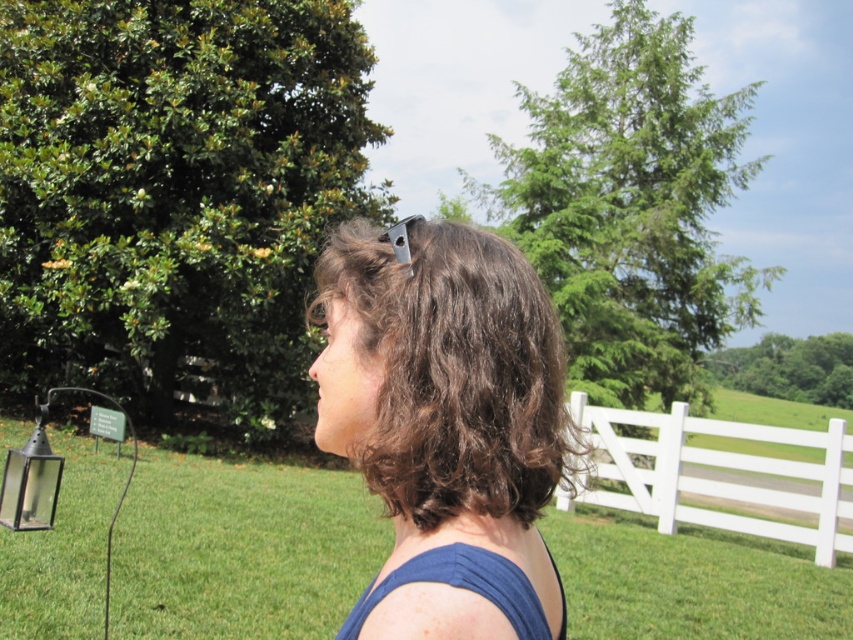
Who is shorter, green leafy tree at upper left or black glass lantern at left?

green leafy tree at upper left

Can you confirm if green leafy tree at upper left is wider than black glass lantern at left?

In fact, green leafy tree at upper left might be narrower than black glass lantern at left.

At what (x,y) coordinates should I click in order to perform the action: click on green leafy tree at upper left. Please return your answer as a coordinate pair (x, y). Image resolution: width=853 pixels, height=640 pixels. Looking at the image, I should click on click(x=177, y=198).

Who is shorter, green leafy tree at upper left or dark brown hair at center?

dark brown hair at center is shorter.

Identify the location of green leafy tree at upper left. This screenshot has height=640, width=853. (177, 198).

Is green leafy tree at upper left above green leafy tree at upper center?

No, green leafy tree at upper left is not above green leafy tree at upper center.

Does green leafy tree at upper left appear on the right side of green leafy tree at upper center?

No, green leafy tree at upper left is not to the right of green leafy tree at upper center.

Find the location of a particular element. This screenshot has height=640, width=853. green leafy tree at upper left is located at coordinates (177, 198).